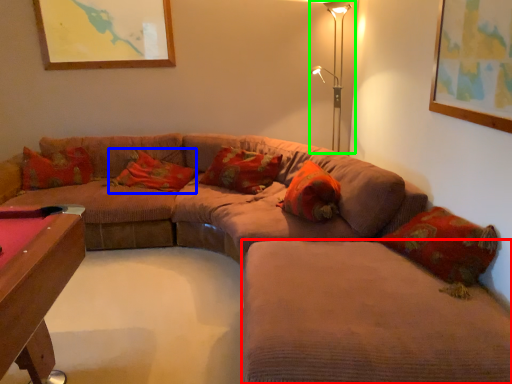
Question: Which object is the farthest from couch (highlighted by a red box)? Choose among these: pillow (highlighted by a blue box) or table lamp (highlighted by a green box).

Choices:
 (A) pillow
 (B) table lamp

Answer: (B)